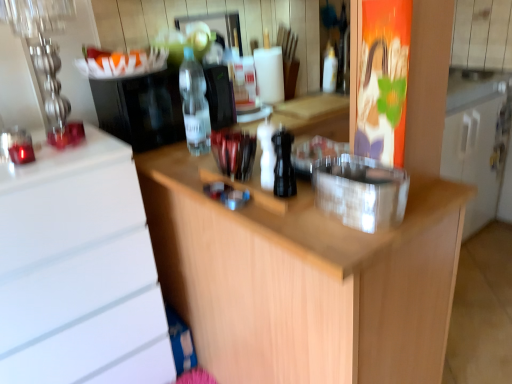
Describe the element at coordinates (304, 281) in the screenshot. I see `wooden at center` at that location.

The width and height of the screenshot is (512, 384). I want to click on wooden at center, so click(x=304, y=281).

Measure the distance between black plastic coffee machine at center, the second appliance in the right-to-left sequence, and camera.

black plastic coffee machine at center, the second appliance in the right-to-left sequence, is 1.40 meters away from camera.

What is the approximate height of transparent plastic container at center, which is counted as the first appliance, starting from the bottom?

3.70 inches.

The height and width of the screenshot is (384, 512). What do you see at coordinates (283, 164) in the screenshot? I see `black matte pepper grinder at center, which is counted as the 3th bottle, starting from the top` at bounding box center [283, 164].

How much space does transparent plastic bottle at center, which ranks as the second bottle in bottom-to-top order, occupy vertically?

transparent plastic bottle at center, which ranks as the second bottle in bottom-to-top order, is 33.94 centimeters tall.

This screenshot has height=384, width=512. I want to click on wooden at center, so click(304, 281).

Looking at this image, which is closer to the camera, (399,170) or (323,67)?

The point (399,170) is more forward.

From a real-world perspective, is transparent plastic container at center, acting as the 2th appliance starting from the top, physically located above or below transparent plastic bottle at upper center, arranged as the first bottle when viewed from the right?

transparent plastic container at center, acting as the 2th appliance starting from the top, is below transparent plastic bottle at upper center, arranged as the first bottle when viewed from the right.

Can you tell me how much transparent plastic container at center, which is counted as the 1th appliance, starting from the front, and transparent plastic bottle at upper center, which is the 1th bottle in top-to-bottom order, differ in facing direction?

The angle between the facing direction of transparent plastic container at center, which is counted as the 1th appliance, starting from the front, and the facing direction of transparent plastic bottle at upper center, which is the 1th bottle in top-to-bottom order, is 87.6 degrees.

Is the depth of transparent plastic container at center, acting as the 2th appliance starting from the top, greater than that of transparent plastic bottle at upper center, arranged as the third bottle when viewed from the front?

No.

Between point (360, 229) and point (422, 349), which one is positioned behind?

The point (422, 349) is more distant.

Is transparent plastic container at center, the second appliance from the left, located outside wooden at center?

transparent plastic container at center, the second appliance from the left, lies outside wooden at center's area.

Does transparent plastic container at center, which is counted as the first appliance, starting from the bottom, come in front of wooden at center?

No, transparent plastic container at center, which is counted as the first appliance, starting from the bottom, is further to the viewer.

From the image's perspective, would you say black matte pepper grinder at center, which is counted as the 3th bottle, starting from the top, is shown under transparent plastic container at center, the second appliance from the left?

Actually, black matte pepper grinder at center, which is counted as the 3th bottle, starting from the top, appears above transparent plastic container at center, the second appliance from the left, in the image.

Considering the sizes of objects black matte pepper grinder at center, arranged as the third bottle when viewed from the back, and transparent plastic container at center, which is the second appliance in back-to-front order, in the image provided, who is thinner, black matte pepper grinder at center, arranged as the third bottle when viewed from the back, or transparent plastic container at center, which is the second appliance in back-to-front order,?

black matte pepper grinder at center, arranged as the third bottle when viewed from the back, is thinner.

Can you confirm if black matte pepper grinder at center, the second bottle viewed from the right, is shorter than transparent plastic container at center, which is counted as the first appliance, starting from the bottom?

Incorrect, the height of black matte pepper grinder at center, the second bottle viewed from the right, does not fall short of that of transparent plastic container at center, which is counted as the first appliance, starting from the bottom.

Between black matte pepper grinder at center, which ranks as the 2th bottle in left-to-right order, and transparent plastic container at center, which is counted as the first appliance, starting from the bottom, which one has smaller size?

Smaller between the two is black matte pepper grinder at center, which ranks as the 2th bottle in left-to-right order.

Which of these two, transparent plastic bottle at center, the 2th bottle viewed from the back, or transparent plastic bottle at upper center, which is the 1th bottle in top-to-bottom order, is wider?

Wider between the two is transparent plastic bottle at center, the 2th bottle viewed from the back.

How many degrees apart are the facing directions of transparent plastic bottle at center, which is the 1th bottle from left to right, and transparent plastic bottle at upper center, which appears as the 1th bottle when viewed from the back?

The facing directions of transparent plastic bottle at center, which is the 1th bottle from left to right, and transparent plastic bottle at upper center, which appears as the 1th bottle when viewed from the back, are 87.8 degrees apart.

From the image's perspective, between transparent plastic bottle at center, placed as the second bottle when sorted from top to bottom, and transparent plastic bottle at upper center, arranged as the third bottle when viewed from the front, who is located below?

From the image's view, transparent plastic bottle at center, placed as the second bottle when sorted from top to bottom, is below.

Which object is thinner, black matte pepper grinder at center, the 1th bottle positioned from the front, or white glossy cabinet at left?

black matte pepper grinder at center, the 1th bottle positioned from the front, is thinner.

Considering the sizes of objects black matte pepper grinder at center, arranged as the third bottle when viewed from the back, and white glossy cabinet at left in the image provided, who is bigger, black matte pepper grinder at center, arranged as the third bottle when viewed from the back, or white glossy cabinet at left?

With larger size is white glossy cabinet at left.

Is white glossy cabinet at left at the back of black matte pepper grinder at center, the 1th bottle positioned from the front?

No, white glossy cabinet at left is not at the back of black matte pepper grinder at center, the 1th bottle positioned from the front.

Between transparent plastic bottle at upper center, marked as the 3th bottle in a left-to-right arrangement, and wooden at center, which one has larger size?

With larger size is wooden at center.

Is transparent plastic bottle at upper center, arranged as the third bottle when viewed from the front, to the right of wooden at center from the viewer's perspective?

Indeed, transparent plastic bottle at upper center, arranged as the third bottle when viewed from the front, is positioned on the right side of wooden at center.

Measure the distance between transparent plastic bottle at upper center, which is the 1th bottle in top-to-bottom order, and wooden at center.

They are 4.24 feet apart.

Could you tell me if transparent plastic bottle at upper center, arranged as the third bottle when viewed from the front, is facing wooden at center?

No, transparent plastic bottle at upper center, arranged as the third bottle when viewed from the front, is not facing towards wooden at center.

Is the depth of transparent plastic bottle at upper center, the third bottle ordered from the bottom, greater than that of black matte pepper grinder at center, which is counted as the first bottle, starting from the bottom?

Yes, transparent plastic bottle at upper center, the third bottle ordered from the bottom, is further from the camera.

Considering the sizes of transparent plastic bottle at upper center, arranged as the first bottle when viewed from the right, and black matte pepper grinder at center, arranged as the third bottle when viewed from the back, in the image, is transparent plastic bottle at upper center, arranged as the first bottle when viewed from the right, bigger or smaller than black matte pepper grinder at center, arranged as the third bottle when viewed from the back,?

Considering their sizes, transparent plastic bottle at upper center, arranged as the first bottle when viewed from the right, takes up more space than black matte pepper grinder at center, arranged as the third bottle when viewed from the back.

Would you say transparent plastic bottle at upper center, which appears as the 1th bottle when viewed from the back, contains black matte pepper grinder at center, which ranks as the 2th bottle in left-to-right order?

Definitely not — black matte pepper grinder at center, which ranks as the 2th bottle in left-to-right order, is not inside transparent plastic bottle at upper center, which appears as the 1th bottle when viewed from the back.

Identify the location of appliance located underneath the transparent plastic bottle at upper center, arranged as the third bottle when viewed from the front (from a real-world perspective). (360, 191).

The width and height of the screenshot is (512, 384). In order to click on countertop on the right of the transparent plastic container at center, which is the second appliance in back-to-front order in this screenshot , I will do `click(304, 281)`.

Based on their spatial positions, is black matte pepper grinder at center, which is counted as the first bottle, starting from the bottom, or transparent plastic container at center, which is counted as the 1th appliance, starting from the front, further from wooden at center?

black matte pepper grinder at center, which is counted as the first bottle, starting from the bottom, lies further to wooden at center than the other object.

Based on their spatial positions, is transparent plastic bottle at center, which is the 1th bottle from left to right, or black plastic coffee machine at center, which is the 2th appliance in bottom-to-top order, further from white glossy cabinet at left?

The object further to white glossy cabinet at left is transparent plastic bottle at center, which is the 1th bottle from left to right.

From the image, which object appears to be farther from transparent plastic bottle at upper center, the third bottle ordered from the bottom, transparent plastic container at center, which is counted as the 1th appliance, starting from the front, or white glossy cabinet at left?

Based on the image, white glossy cabinet at left appears to be further to transparent plastic bottle at upper center, the third bottle ordered from the bottom.

Looking at this image, from the image, which object appears to be farther from black plastic coffee machine at center, which appears as the first appliance when viewed from the back, black matte pepper grinder at center, which ranks as the 2th bottle in left-to-right order, or wooden at center?

black matte pepper grinder at center, which ranks as the 2th bottle in left-to-right order, is further to black plastic coffee machine at center, which appears as the first appliance when viewed from the back.

When comparing their distances from black matte pepper grinder at center, which is counted as the 3th bottle, starting from the top, does transparent plastic bottle at center, the 2th bottle viewed from the back, or transparent plastic bottle at upper center, marked as the 3th bottle in a left-to-right arrangement, seem closer?

transparent plastic bottle at center, the 2th bottle viewed from the back, is positioned closer to the anchor black matte pepper grinder at center, which is counted as the 3th bottle, starting from the top.

When comparing their distances from wooden at center, does transparent plastic bottle at upper center, marked as the 3th bottle in a left-to-right arrangement, or transparent plastic bottle at center, the 2th bottle viewed from the back, seem further?

transparent plastic bottle at upper center, marked as the 3th bottle in a left-to-right arrangement, lies further to wooden at center than the other object.

Estimate the real-world distances between objects in this image. Which object is further from black plastic coffee machine at center, which is the 2th appliance in bottom-to-top order, white glossy cabinet at left or transparent plastic bottle at center, which is the second bottle from front to back?

white glossy cabinet at left.

Looking at the image, which one is located closer to black plastic coffee machine at center, which appears as the first appliance when viewed from the back, wooden at center or transparent plastic container at center, which is counted as the first appliance, starting from the bottom?

wooden at center.

Locate an element on the screen. bottle between white glossy cabinet at left and black matte pepper grinder at center, which is counted as the 3th bottle, starting from the top, in the horizontal direction is located at coordinates (194, 104).

Identify the location of appliance between white glossy cabinet at left and transparent plastic bottle at upper center, arranged as the third bottle when viewed from the front, along the z-axis. (141, 108).

The width and height of the screenshot is (512, 384). In order to click on appliance between white glossy cabinet at left and transparent plastic container at center, which is counted as the 1th appliance, starting from the front, in the horizontal direction in this screenshot , I will do `click(141, 108)`.

You are a GUI agent. You are given a task and a screenshot of the screen. Output one action in this format:
    pyautogui.click(x=<x>, y=<y>)
    Task: Click on the appliance between wooden at center and transparent plastic bottle at center, which is the 1th bottle from left to right, from front to back
    The image size is (512, 384).
    Given the screenshot: What is the action you would take?
    pyautogui.click(x=360, y=191)